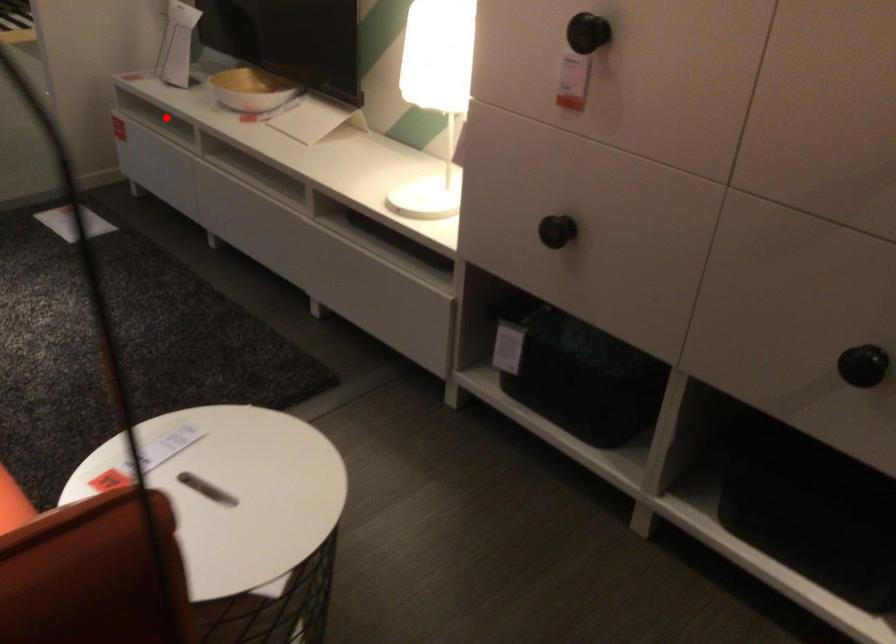
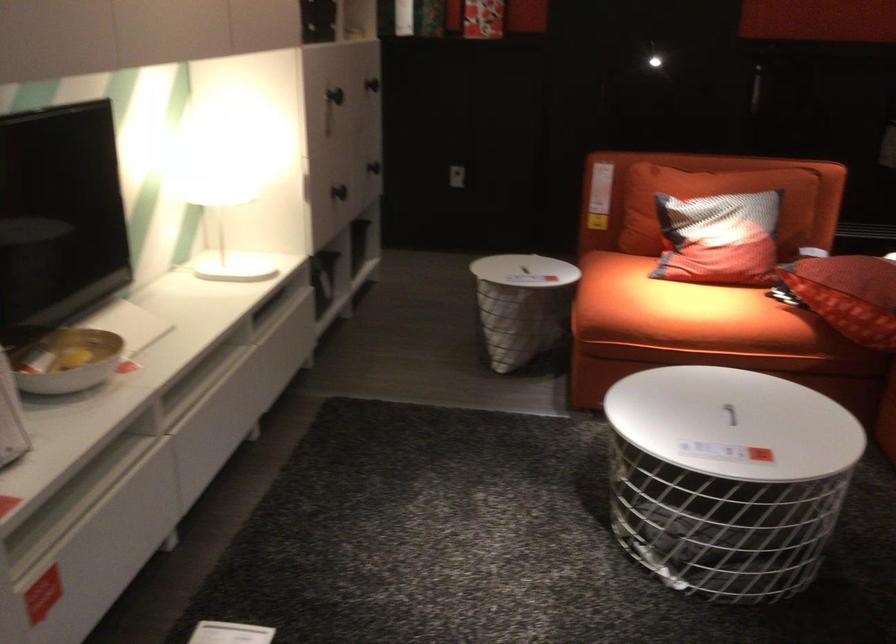
Question: I am providing you with two images of the same scene from different viewpoints. In image1, a red point is highlighted. Considering the same 3D point in image2, which of the following is correct?

Choices:
 (A) It is closer
 (B) It is farther

Answer: (A)